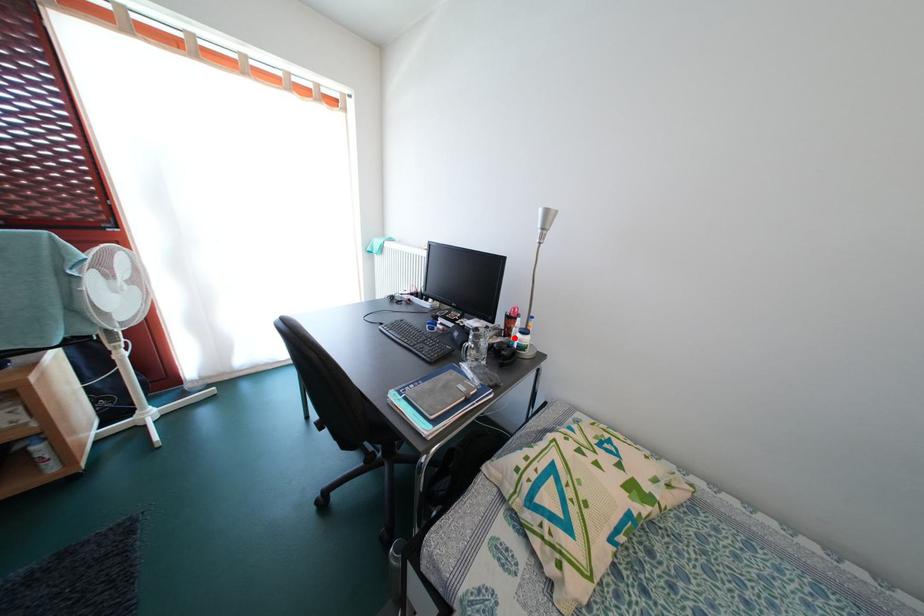
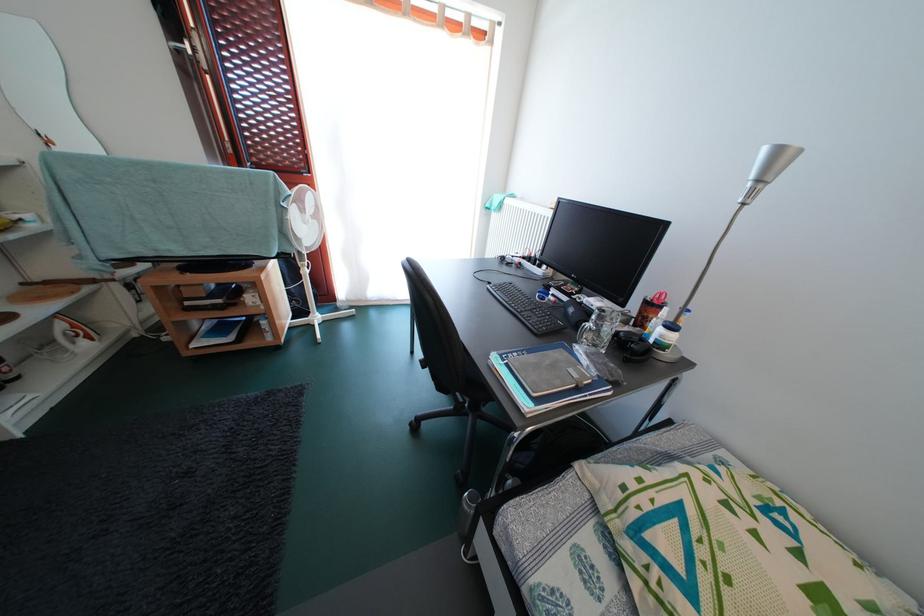
Where in the second image is the point corresponding to the highlighted location from the first image?

(648, 328)